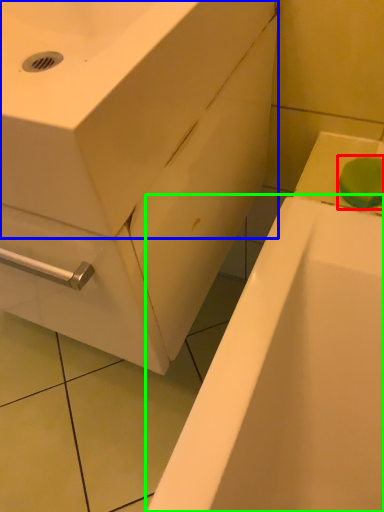
Question: Which object is positioned farthest from soap (highlighted by a red box)? Select from sink (highlighted by a blue box) and bathtub (highlighted by a green box).

Choices:
 (A) sink
 (B) bathtub

Answer: (A)